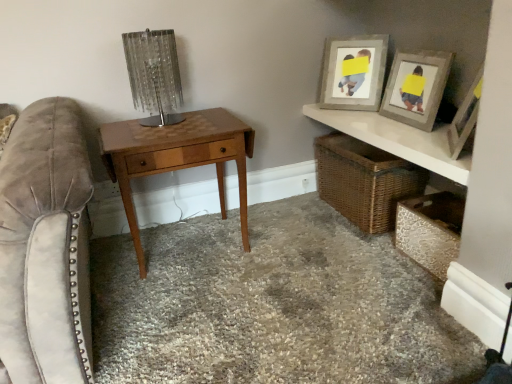
Question: Is wooden picture frame at upper right, the 1th picture frame positioned from the back, surrounded by white glossy shelf at upper right, which ranks as the second shelf in bottom-to-top order?

Choices:
 (A) no
 (B) yes

Answer: (A)

Question: Is white glossy shelf at upper right, which ranks as the 1th shelf in top-to-bottom order, closer to the viewer compared to wooden picture frame at upper right, the second picture frame in the front-to-back sequence?

Choices:
 (A) no
 (B) yes

Answer: (B)

Question: Is white glossy shelf at upper right, which ranks as the 1th shelf in top-to-bottom order, at the left side of wooden picture frame at upper right, the 1th picture frame positioned from the back?

Choices:
 (A) no
 (B) yes

Answer: (A)

Question: Can you confirm if white glossy shelf at upper right, which ranks as the second shelf in bottom-to-top order, is shorter than wooden picture frame at upper right, the 1th picture frame positioned from the back?

Choices:
 (A) no
 (B) yes

Answer: (B)

Question: Is white glossy shelf at upper right, which ranks as the 1th shelf in top-to-bottom order, taller than wooden picture frame at upper right, the second picture frame in the front-to-back sequence?

Choices:
 (A) no
 (B) yes

Answer: (A)

Question: Is white glossy shelf at upper right, which ranks as the second shelf in bottom-to-top order, oriented away from wooden picture frame at upper right, the second picture frame in the front-to-back sequence?

Choices:
 (A) no
 (B) yes

Answer: (A)

Question: Is metallic textured chest at lower right, which is counted as the first shelf, starting from the bottom, taller than white glossy shelf at upper right, which ranks as the 1th shelf in top-to-bottom order?

Choices:
 (A) yes
 (B) no

Answer: (A)

Question: Does metallic textured chest at lower right, the second shelf positioned from the top, appear on the right side of white glossy shelf at upper right, which ranks as the second shelf in bottom-to-top order?

Choices:
 (A) yes
 (B) no

Answer: (A)

Question: Is metallic textured chest at lower right, the second shelf positioned from the top, positioned with its back to white glossy shelf at upper right, which ranks as the 1th shelf in top-to-bottom order?

Choices:
 (A) yes
 (B) no

Answer: (B)

Question: Is metallic textured chest at lower right, which is counted as the first shelf, starting from the bottom, further to the viewer compared to white glossy shelf at upper right, which ranks as the second shelf in bottom-to-top order?

Choices:
 (A) yes
 (B) no

Answer: (A)

Question: Could you tell me if metallic textured chest at lower right, which is counted as the first shelf, starting from the bottom, is turned towards white glossy shelf at upper right, which ranks as the second shelf in bottom-to-top order?

Choices:
 (A) no
 (B) yes

Answer: (A)

Question: Is metallic textured chest at lower right, which is counted as the first shelf, starting from the bottom, next to white glossy shelf at upper right, which ranks as the 1th shelf in top-to-bottom order?

Choices:
 (A) no
 (B) yes

Answer: (A)

Question: From the image's perspective, would you say wooden picture frame at upper right, the second picture frame in the front-to-back sequence, is shown under carpeted floor at center?

Choices:
 (A) yes
 (B) no

Answer: (B)